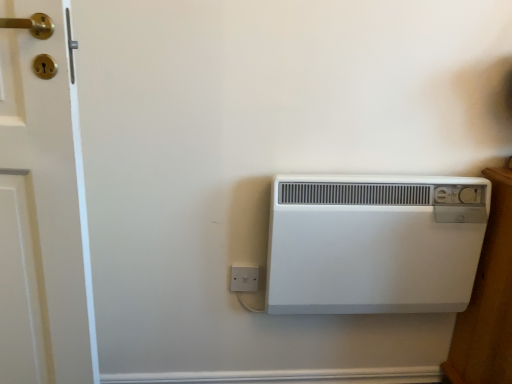
Question: Considering the relative positions of white plastic electric outlet at lower center and white plastic heater at center in the image provided, is white plastic electric outlet at lower center to the left or to the right of white plastic heater at center?

Choices:
 (A) right
 (B) left

Answer: (B)

Question: In terms of size, does white plastic electric outlet at lower center appear bigger or smaller than white plastic heater at center?

Choices:
 (A) big
 (B) small

Answer: (B)

Question: Is point (236, 289) positioned closer to the camera than point (460, 185)?

Choices:
 (A) closer
 (B) farther

Answer: (B)

Question: Is point (297, 291) closer or farther from the camera than point (238, 269)?

Choices:
 (A) farther
 (B) closer

Answer: (B)

Question: Relative to white plastic electric outlet at lower center, is white plastic heater at center in front or behind?

Choices:
 (A) front
 (B) behind

Answer: (A)

Question: Would you say white plastic heater at center is to the left or to the right of white plastic electric outlet at lower center in the picture?

Choices:
 (A) left
 (B) right

Answer: (B)

Question: From a real-world perspective, is white plastic heater at center positioned above or below white plastic electric outlet at lower center?

Choices:
 (A) above
 (B) below

Answer: (A)